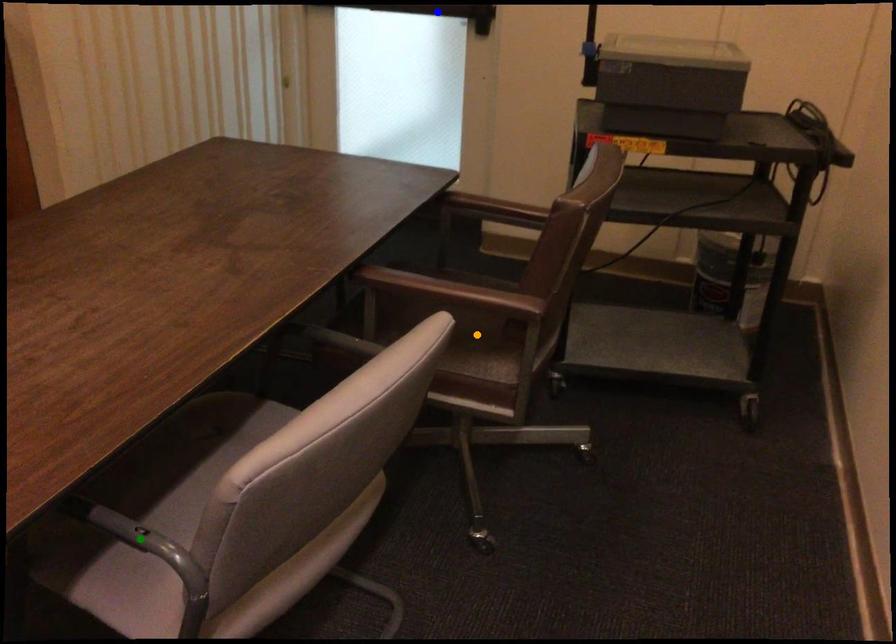
Order these from nearest to farthest:
orange point, blue point, green point

green point < orange point < blue point